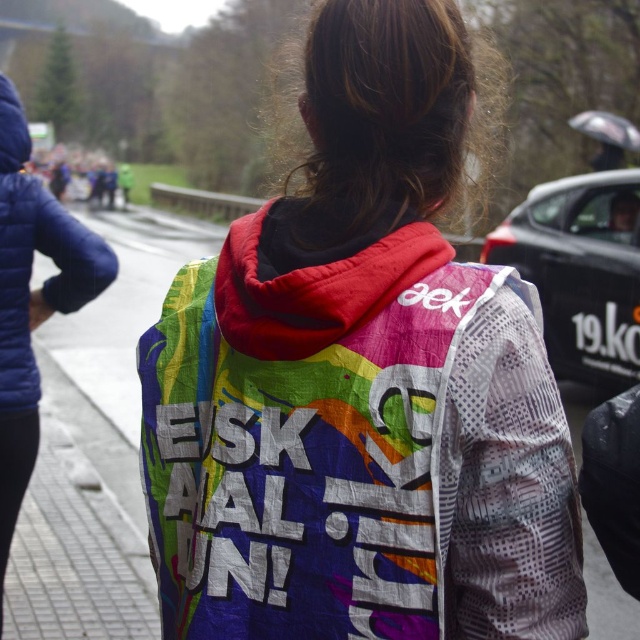
You are standing on the path and see the black textured car at right. If you want to reach the car within 10 seconds, what is the minimum speed you need to maintain?

The black textured car at right is 7.34 meters away. To reach it within 10 seconds, you need to maintain a minimum speed of 0.734 meters per second.

From the picture: You are standing at the starting line of a race and see the person in the colorful jacket with bold text. Where is the rainbow fabric hoodie located relative to the point marked at coordinates (360, 385)?

The rainbow fabric hoodie at center is located exactly at the point marked at coordinates (360, 385).

You are a pedestrian trying to cross the road where the black textured car at right and the rainbow fabric jacket at left are located. The road is 6 meters wide. Can you safely cross the road without stepping into the path of either object?

The distance between the black textured car at right and the rainbow fabric jacket at left is 5.22 meters. Since the road is 6 meters wide, there is enough space between them to safely cross without stepping into either object.